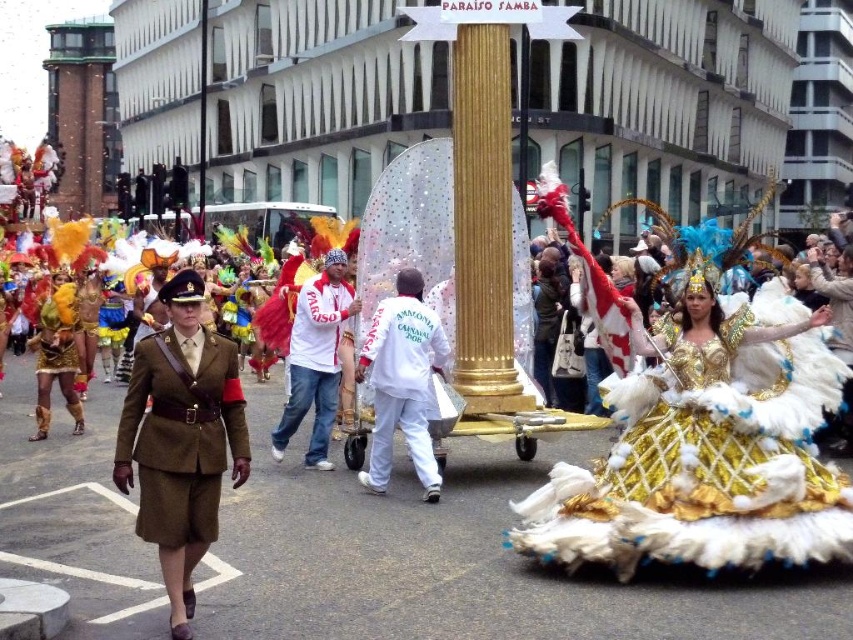
Question: Which object appears closest to the camera in this image?

Choices:
 (A) white matte uniform at center
 (B) white matte shirt at center

Answer: (A)

Question: Does khaki fabric uniform at center appear on the right side of shiny gold costume at left?

Choices:
 (A) no
 (B) yes

Answer: (B)

Question: Is gold sequined dress at center thinner than khaki fabric uniform at center?

Choices:
 (A) yes
 (B) no

Answer: (B)

Question: Based on their relative distances, which object is farther from the white matte shirt at center?

Choices:
 (A) shiny gold costume at left
 (B) khaki fabric uniform at center
 (C) gold sequined dress at center

Answer: (C)

Question: Which point is closer to the camera?

Choices:
 (A) white matte uniform at center
 (B) khaki fabric uniform at center
 (C) white matte shirt at center

Answer: (B)

Question: Is white matte uniform at center smaller than white matte shirt at center?

Choices:
 (A) no
 (B) yes

Answer: (B)